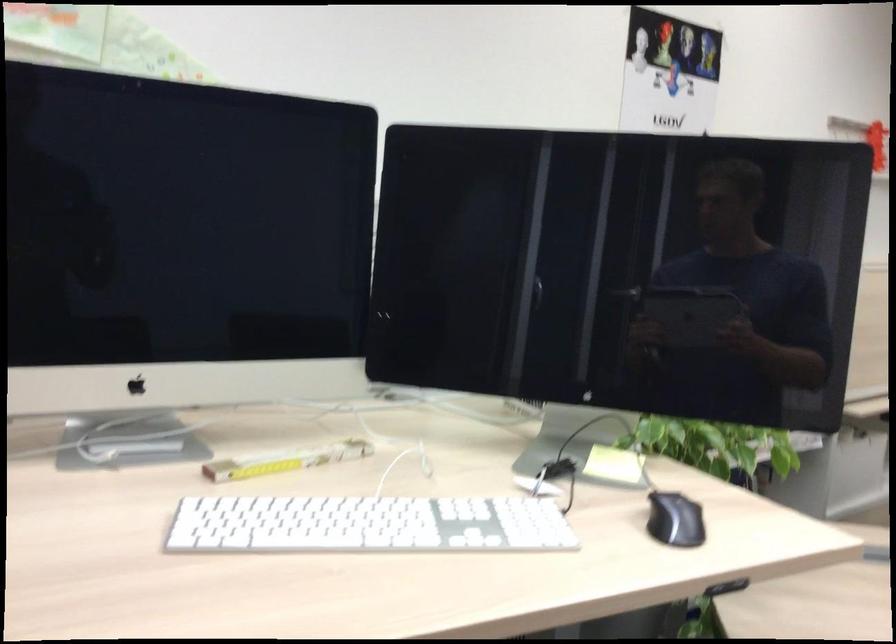
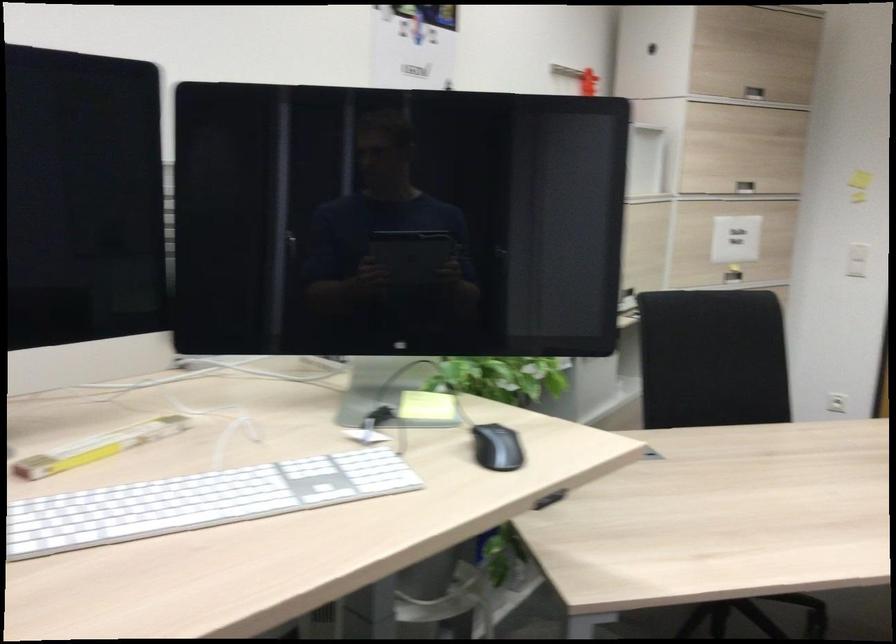
Question: What movement of the cameraman would produce the second image?

Choices:
 (A) Left
 (B) Right
 (C) Forward
 (D) Backward

Answer: (A)